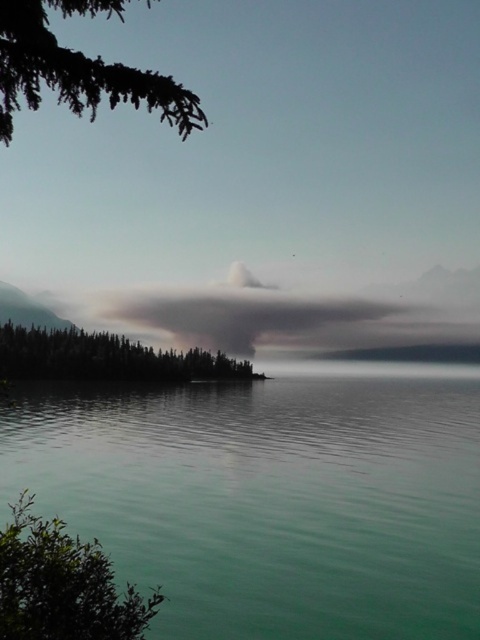
You are standing at the edge of the lake and notice a green leafy bush at lower left. Can you confirm if this bush is positioned at coordinates point (62, 584)?

Yes, the green leafy bush at lower left is located at point (62, 584).